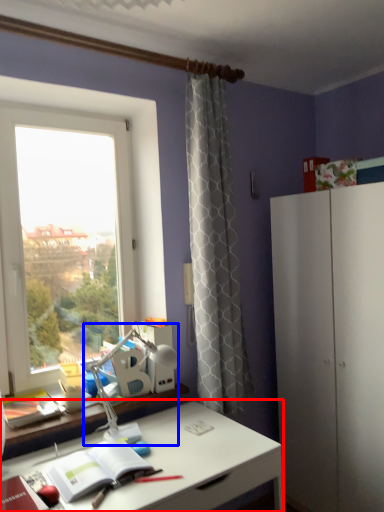
Question: Which of the following is the farthest to the observer, desk (highlighted by a red box) or table lamp (highlighted by a blue box)?

Choices:
 (A) desk
 (B) table lamp

Answer: (B)